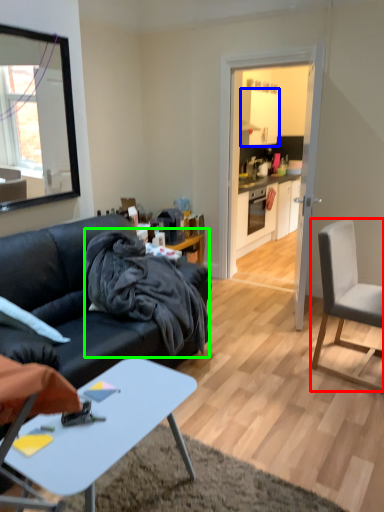
Question: Which object is the farthest from chair (highlighted by a red box)? Choose among these: cabinetry (highlighted by a blue box) or material (highlighted by a green box).

Choices:
 (A) cabinetry
 (B) material

Answer: (A)